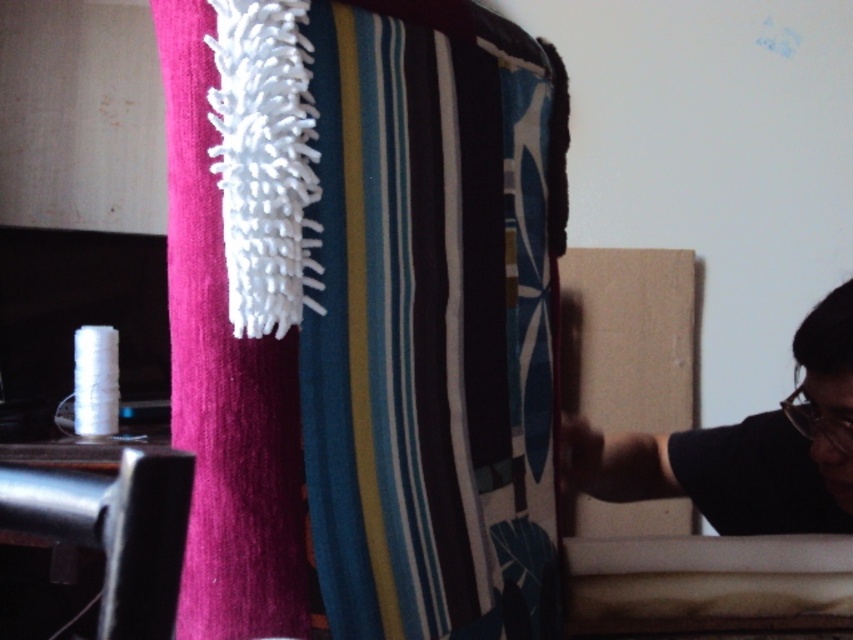
Can you confirm if white fuzzy brush at left is bigger than black matte person at right?

Actually, white fuzzy brush at left might be smaller than black matte person at right.

Who is positioned more to the left, white fuzzy brush at left or black matte person at right?

white fuzzy brush at left is more to the left.

Identify the location of white fuzzy brush at left. The height and width of the screenshot is (640, 853). (225, 385).

Who is more forward, (479,564) or (831,515)?

Point (479,564) is more forward.

Can you confirm if striped fabric at center is smaller than black matte person at right?

No, striped fabric at center is not smaller than black matte person at right.

Where is `striped fabric at center`? This screenshot has height=640, width=853. striped fabric at center is located at coordinates (363, 320).

Is striped fabric at center closer to camera compared to white fuzzy brush at left?

Yes, it is.

Who is more distant from viewer, [457,346] or [283,372]?

Point [457,346]

Locate an element on the screen. This screenshot has height=640, width=853. striped fabric at center is located at coordinates (363, 320).